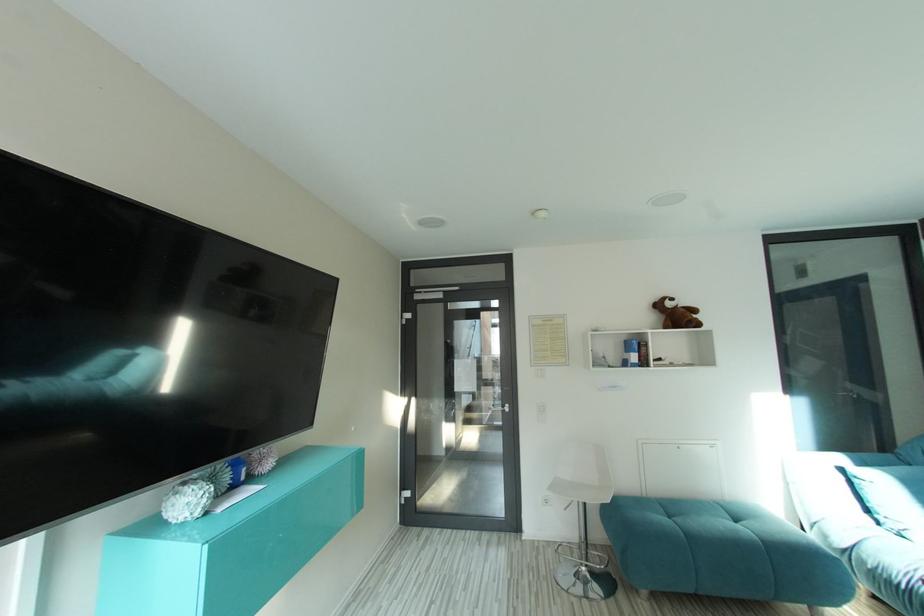
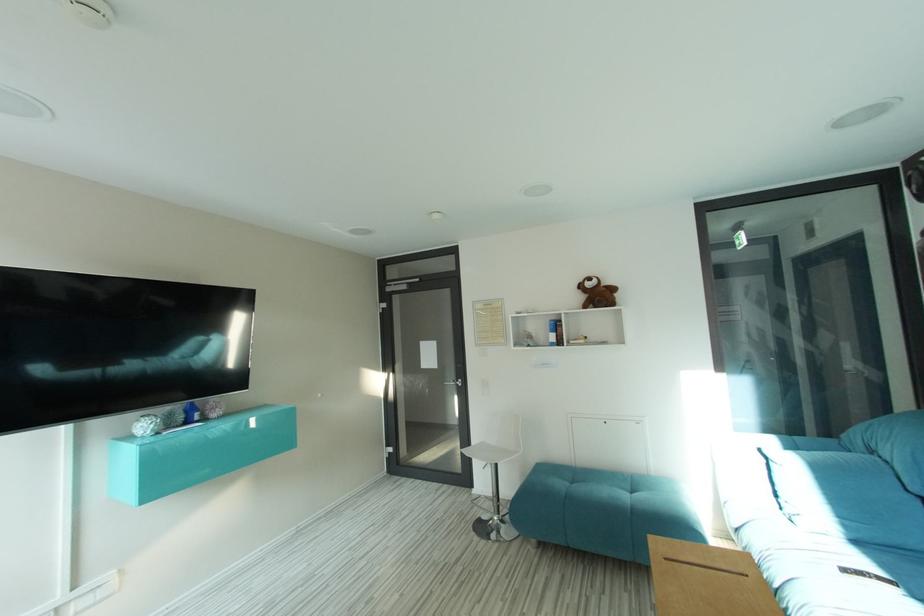
Question: The images are taken continuously from a first-person perspective. In which direction are you moving?

Choices:
 (A) Left
 (B) Right
 (C) Forward
 (D) Backward

Answer: (B)